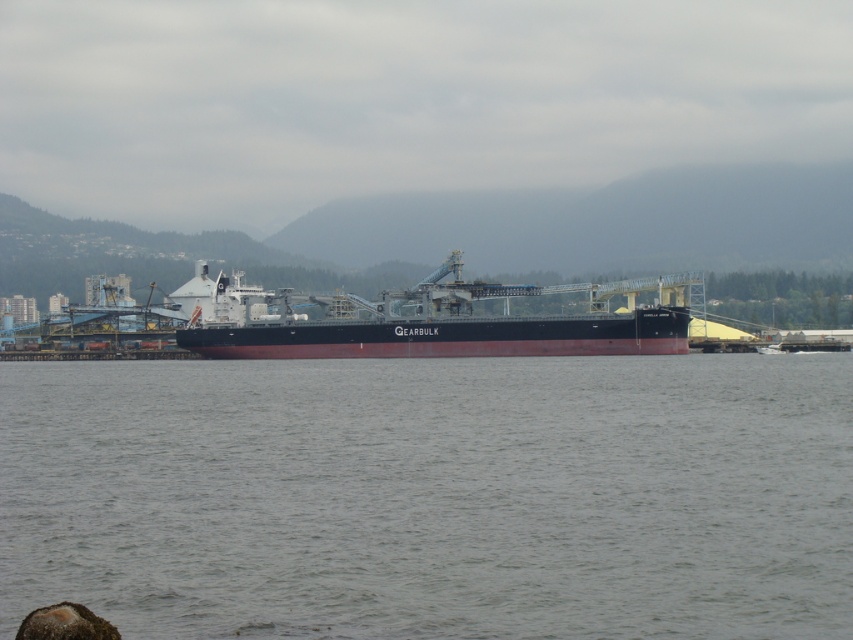
You are a port authority inspector assessing the docking area. You notice the gray water at center and the black matte cargo ship at center. Which object is taller from the perspective of someone standing on the dock?

The black matte cargo ship at center is taller than the gray water at center.

You are a crane operator on the black matte cargo ship at center. You need to lower a heavy container into the gray water at center. The container is 5 meters long. Can you safely lower it into the water without the container hitting the ship?

The distance between the gray water at center and black matte cargo ship at center is 46.12 meters. Since the container is only 5 meters long, there is plenty of space to lower it safely without hitting the ship.